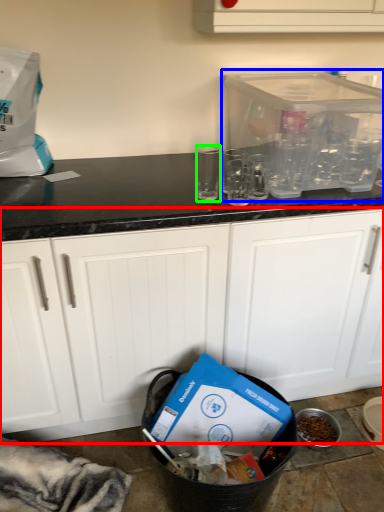
Question: Which is farther away from cabinetry (highlighted by a red box)? appliance (highlighted by a blue box) or clear (highlighted by a green box)?

Choices:
 (A) appliance
 (B) clear

Answer: (B)